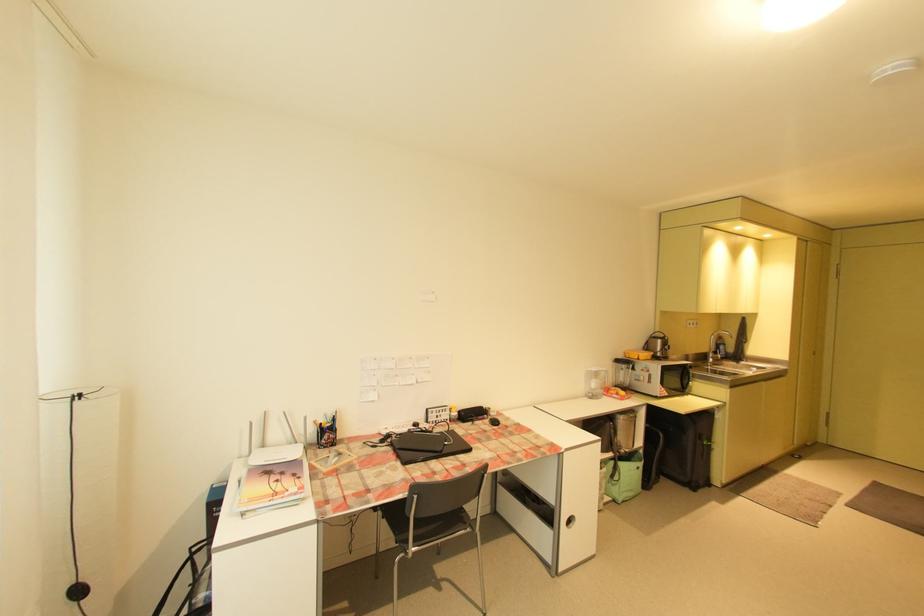
Where would you pull the microwave door handle? Please return your answer as a coordinate pair (x, y).

(686, 377)